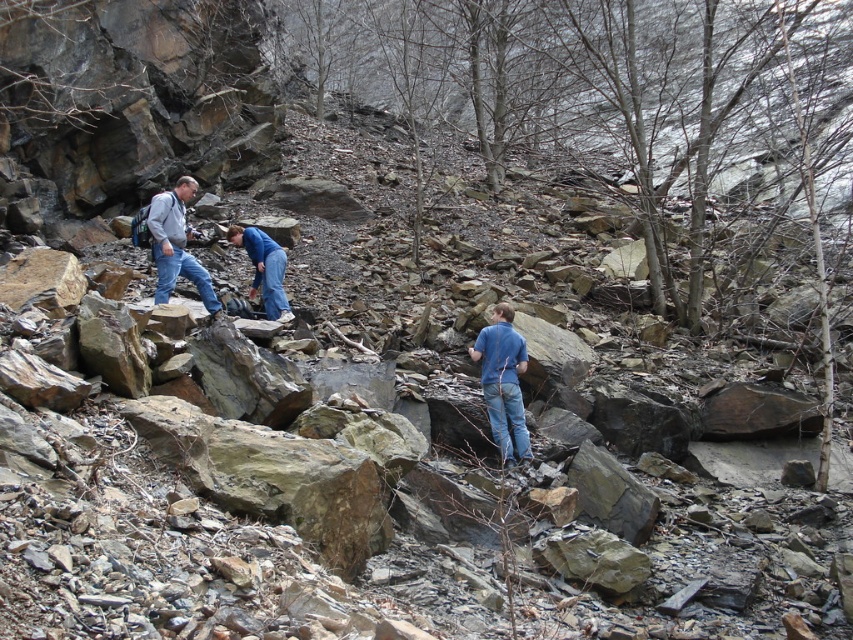
Question: Can you confirm if blue jeans at center is positioned below denim jacket at left?

Choices:
 (A) yes
 (B) no

Answer: (A)

Question: Is blue jeans at center closer to camera compared to denim jacket at left?

Choices:
 (A) yes
 (B) no

Answer: (A)

Question: Does blue jeans at center appear on the left side of denim jacket at left?

Choices:
 (A) yes
 (B) no

Answer: (B)

Question: Which is nearer to the blue jeans at center?

Choices:
 (A) denim jacket at left
 (B) blue denim jeans at center

Answer: (B)

Question: Which point is farther from the camera taking this photo?

Choices:
 (A) (167, 236)
 (B) (250, 296)

Answer: (B)

Question: Which object is closer to the camera taking this photo?

Choices:
 (A) denim jacket at left
 (B) blue denim jeans at center
 (C) blue jeans at center

Answer: (C)